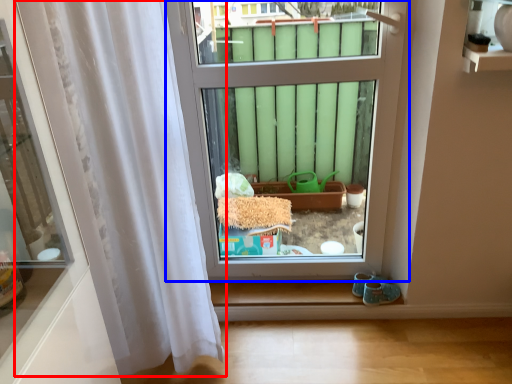
Question: Which object is further to the camera taking this photo, curtain (highlighted by a red box) or window (highlighted by a blue box)?

Choices:
 (A) curtain
 (B) window

Answer: (B)